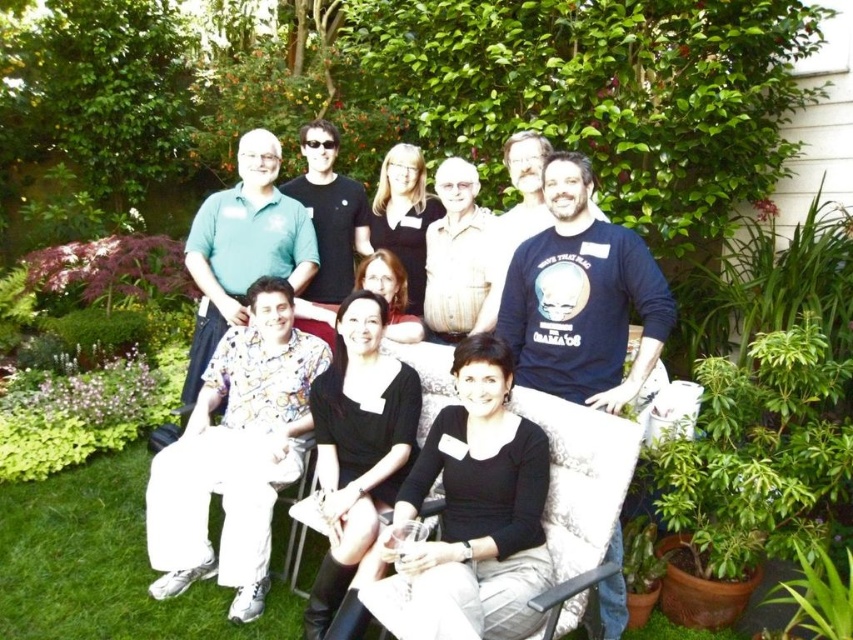
Between point (151, 592) and point (267, 250), which one is positioned in front?

Point (151, 592) is in front.

Does floral-patterned shirt at lower left appear on the left side of green cotton shirt at upper left?

No, floral-patterned shirt at lower left is not to the left of green cotton shirt at upper left.

Who is more distant from viewer, (260,364) or (207,198)?

Positioned behind is point (207,198).

Where is `floral-patterned shirt at lower left`? The image size is (853, 640). floral-patterned shirt at lower left is located at coordinates (235, 454).

Does point (212, 369) come in front of point (384, 484)?

No, it is behind (384, 484).

Does floral-patterned shirt at lower left have a greater width compared to black matte dress at center?

Yes, floral-patterned shirt at lower left is wider than black matte dress at center.

Describe the element at coordinates (235, 454) in the screenshot. The image size is (853, 640). I see `floral-patterned shirt at lower left` at that location.

Locate an element on the screen. This screenshot has width=853, height=640. floral-patterned shirt at lower left is located at coordinates (235, 454).

Is matte black shirt at center thinner than black matte dress at center?

Incorrect, matte black shirt at center's width is not less than black matte dress at center's.

This screenshot has height=640, width=853. What do you see at coordinates (538, 276) in the screenshot? I see `matte black shirt at center` at bounding box center [538, 276].

This screenshot has height=640, width=853. What do you see at coordinates (538, 276) in the screenshot?
I see `matte black shirt at center` at bounding box center [538, 276].

What are the coordinates of `matte black shirt at center` in the screenshot? It's located at (538, 276).